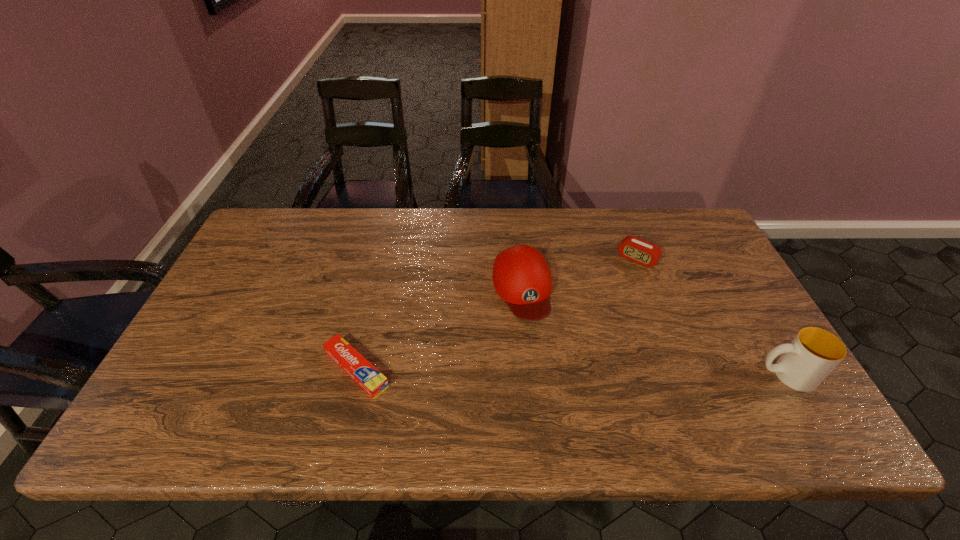
Locate an element on the screen. vacant space on the desktop that is between the leftmost object and the rightmost object and is positioned on the front-facing side of the alarm clock is located at coordinates (554, 372).

I want to click on free spot on the desktop that is between the toothpaste and the rightmost object and is positioned on the front-facing side of the third object from right to left, so (552, 372).